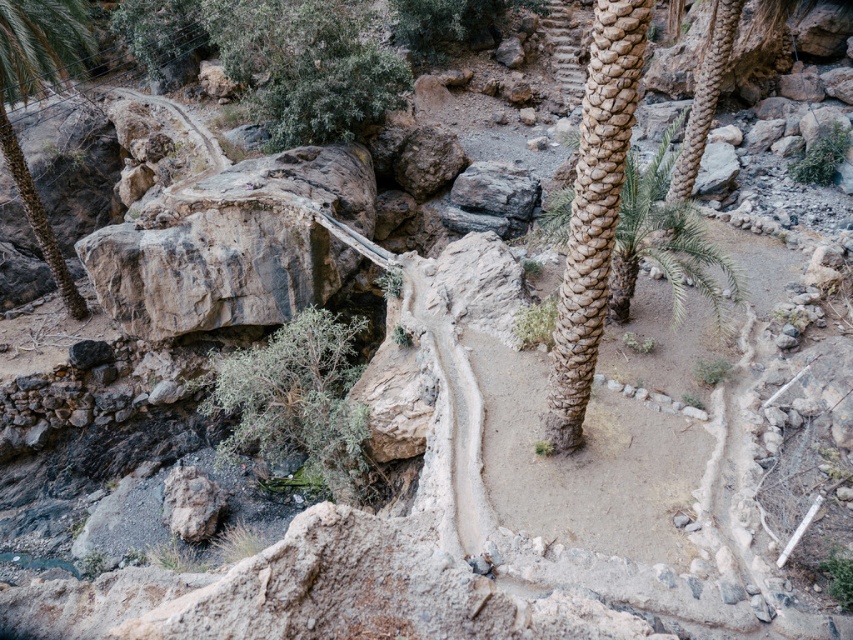
Is green leafy bush at center in front of coarse textured palm tree at center?

No.

From the picture: Who is shorter, green leafy bush at center or coarse textured palm tree at center?

coarse textured palm tree at center

Is point (288, 352) farther from viewer compared to point (631, 161)?

Yes, point (288, 352) is farther from viewer.

You are a GUI agent. You are given a task and a screenshot of the screen. Output one action in this format:
    pyautogui.click(x=<x>, y=<y>)
    Task: Click on the green leafy bush at center
    The image size is (853, 640).
    Given the screenshot: What is the action you would take?
    pyautogui.click(x=299, y=401)

Does brown textured palm trunk at center have a greater height compared to green leafy bush at center?

No.

Can you confirm if brown textured palm trunk at center is positioned to the right of green leafy bush at center?

Indeed, brown textured palm trunk at center is positioned on the right side of green leafy bush at center.

The width and height of the screenshot is (853, 640). I want to click on brown textured palm trunk at center, so click(x=595, y=211).

In the scene shown: Which of these two, coarse textured palm tree at center or green leafy palm at left, stands taller?

green leafy palm at left is taller.

Identify the location of coarse textured palm tree at center. [662, 236].